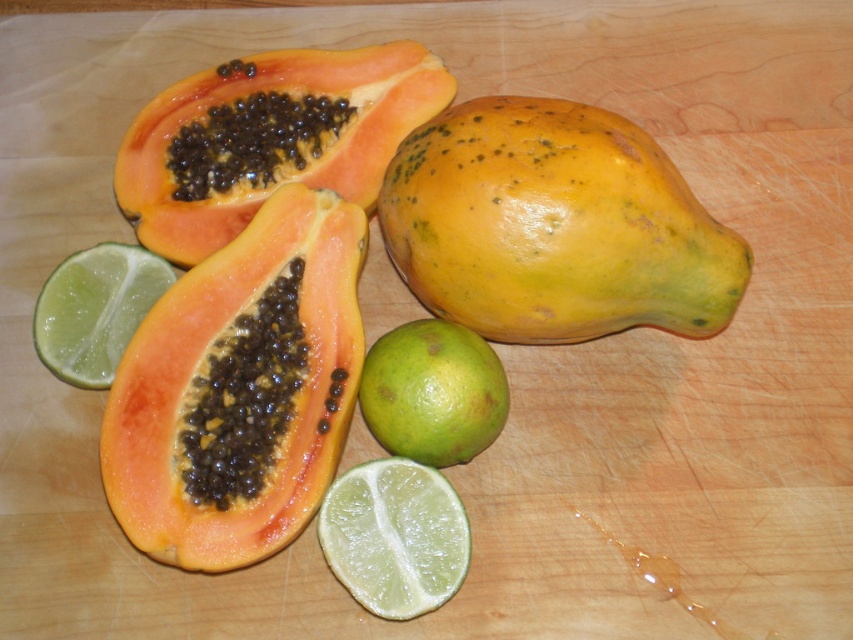
Looking at this image, you are arranging fruits on a cutting board and need to stack them vertically. Given that the yellow matte papaya at center is taller than the green matte lemon at lower left, which fruit should you place at the bottom to ensure stability?

To ensure stability when stacking, you should place the yellow matte papaya at center at the bottom since it is taller and likely has a larger base than the green matte lemon at lower left.

From the picture: You are arranging fruits on a cutting board and want to stack the orange matte papaya at center and the green matte lime at center. Which fruit should you place at the bottom to ensure stability?

The orange matte papaya at center has a greater height compared to the green matte lime at center, so placing the taller orange matte papaya at center at the bottom would provide a more stable base for the stack.